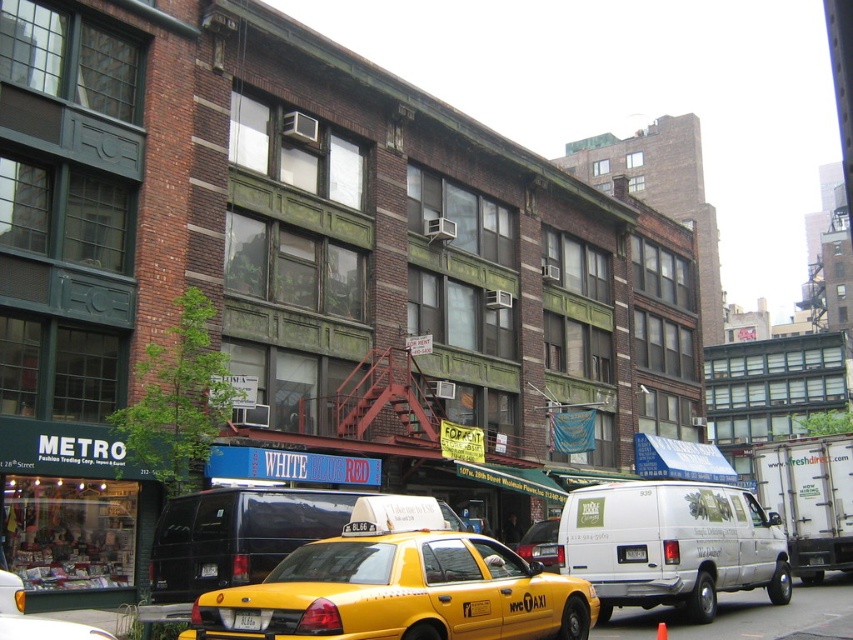
Question: Among these points, which one is nearest to the camera?

Choices:
 (A) (239, 627)
 (B) (337, 506)
 (C) (641, 561)

Answer: (A)

Question: Is the position of yellow matte taxi at center more distant than that of yellow rubber taxi cab at center?

Choices:
 (A) no
 (B) yes

Answer: (A)

Question: Which object appears closest to the camera in this image?

Choices:
 (A) yellow matte taxi at center
 (B) yellow plastic license plate at center
 (C) yellow rubber taxi cab at lower center
 (D) white matte van at center

Answer: (C)

Question: Which object is farther from the camera taking this photo?

Choices:
 (A) yellow plastic taxi cab at center
 (B) yellow matte taxi at center
 (C) yellow rubber taxi cab at lower center
 (D) black matte van at lower left

Answer: (D)

Question: Does yellow rubber taxi cab at lower center have a greater width compared to yellow rubber taxi cab at center?

Choices:
 (A) yes
 (B) no

Answer: (A)

Question: Is yellow rubber taxi cab at center above yellow plastic taxi cab at center?

Choices:
 (A) yes
 (B) no

Answer: (B)